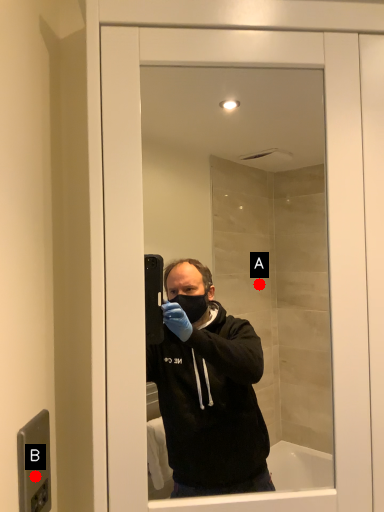
Question: Two points are circled on the image, labeled by A and B beside each circle. Which of the following is the closest to the observer?

Choices:
 (A) A is closer
 (B) B is closer

Answer: (B)